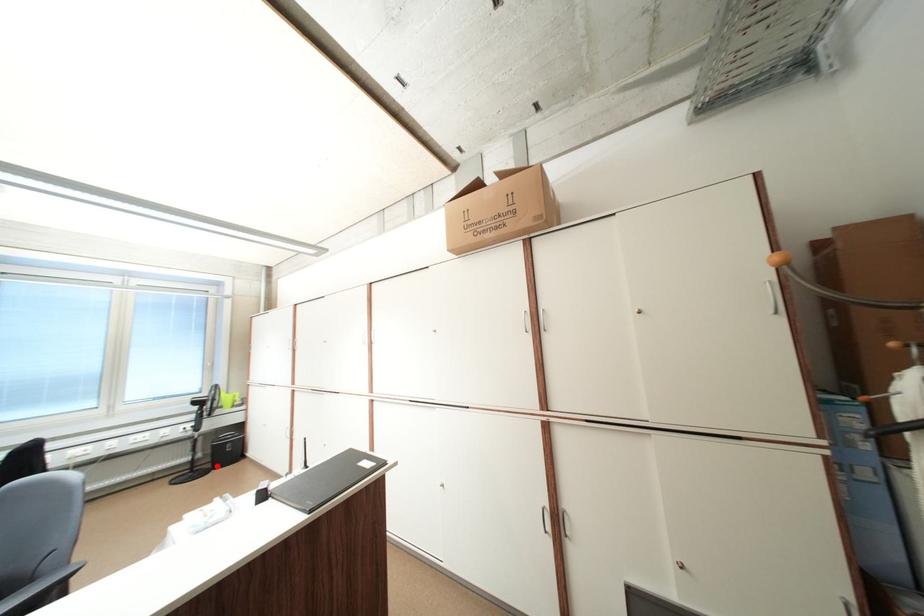
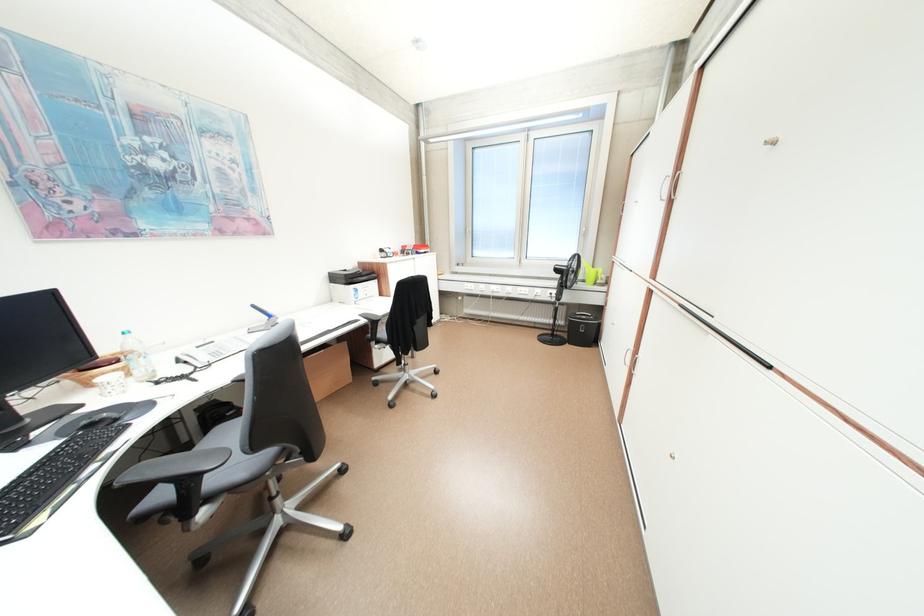
Question: I am providing you with two images of the same scene from different viewpoints. In image1, a red point is highlighted. Considering the same 3D point in image2, which of the following is correct?

Choices:
 (A) It is closer
 (B) It is farther

Answer: (A)